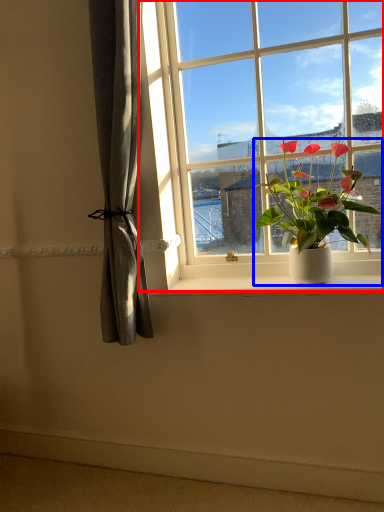
Question: Which object appears farthest to the camera in this image, window (highlighted by a red box) or houseplant (highlighted by a blue box)?

Choices:
 (A) window
 (B) houseplant

Answer: (A)